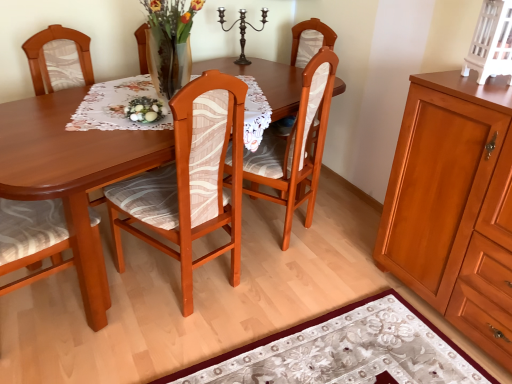
Where is `floral-patterned fabric at lower center`? Image resolution: width=512 pixels, height=384 pixels. floral-patterned fabric at lower center is located at coordinates (345, 351).

The image size is (512, 384). What do you see at coordinates (490, 42) in the screenshot?
I see `white painted wood cabinet at upper right, the second cabinetry ordered from the bottom` at bounding box center [490, 42].

In order to click on white lace tablecloth at center in this screenshot , I will do `click(116, 106)`.

Where is `floral-patterned fabric at lower center`? Image resolution: width=512 pixels, height=384 pixels. floral-patterned fabric at lower center is located at coordinates (345, 351).

From the picture: Considering the relative positions of white painted wood cabinet at upper right, the first cabinetry in the top-to-bottom sequence, and wooden chair at center, the third chair positioned from the left, in the image provided, is white painted wood cabinet at upper right, the first cabinetry in the top-to-bottom sequence, behind wooden chair at center, the third chair positioned from the left,?

That is False.

Could you tell me if white painted wood cabinet at upper right, the second cabinetry ordered from the bottom, is facing wooden chair at center, the third chair positioned from the left?

No, white painted wood cabinet at upper right, the second cabinetry ordered from the bottom, is not aimed at wooden chair at center, the third chair positioned from the left.

From the picture: From the image's perspective, relative to wooden chair at center, the third chair positioned from the left, is white painted wood cabinet at upper right, the second cabinetry ordered from the bottom, above or below?

Clearly, from the image's perspective, white painted wood cabinet at upper right, the second cabinetry ordered from the bottom, is above wooden chair at center, the third chair positioned from the left.

Consider the image. Is white painted wood cabinet at upper right, the second cabinetry ordered from the bottom, not inside wooden chair at center, the third chair positioned from the left?

white painted wood cabinet at upper right, the second cabinetry ordered from the bottom, lies outside wooden chair at center, the third chair positioned from the left,'s area.

Is wooden chair at center, which is the 1th chair in left-to-right order, positioned behind dark brown metal candle holder at upper center?

No.

You are a GUI agent. You are given a task and a screenshot of the screen. Output one action in this format:
    pyautogui.click(x=<x>, y=<y>)
    Task: Click on the candle holder lying on the right of wooden chair at center, positioned as the third chair in right-to-left order
    The image size is (512, 384).
    Given the screenshot: What is the action you would take?
    pyautogui.click(x=242, y=30)

From the image's perspective, does wooden chair at center, positioned as the third chair in right-to-left order, appear lower than dark brown metal candle holder at upper center?

Yes, from the image's perspective, wooden chair at center, positioned as the third chair in right-to-left order, is below dark brown metal candle holder at upper center.

Is wooden chair at center, which is the 1th chair in left-to-right order, bigger than dark brown metal candle holder at upper center?

Correct, wooden chair at center, which is the 1th chair in left-to-right order, is larger in size than dark brown metal candle holder at upper center.

Identify the location of place mat on the right of the white lace tablecloth at center. (345, 351).

Which is nearer, (251, 111) or (376, 298)?

Point (251, 111).

Are white lace tablecloth at center and floral-patterned fabric at lower center beside each other?

They are not placed beside each other.

Is white lace tablecloth at center aimed at floral-patterned fabric at lower center?

No, white lace tablecloth at center is not turned towards floral-patterned fabric at lower center.

Locate an element on the screen. The width and height of the screenshot is (512, 384). place mat in front of the wooden chair at center, positioned as the third chair in right-to-left order is located at coordinates (345, 351).

Is wooden chair at center, positioned as the third chair in right-to-left order, outside of floral-patterned fabric at lower center?

Absolutely, wooden chair at center, positioned as the third chair in right-to-left order, is external to floral-patterned fabric at lower center.

From the image's perspective, is wooden chair at center, positioned as the third chair in right-to-left order, above floral-patterned fabric at lower center?

Yes, from the image's perspective, wooden chair at center, positioned as the third chair in right-to-left order, is above floral-patterned fabric at lower center.

Considering the positions of objects wooden chair at center, positioned as the third chair in right-to-left order, and floral-patterned fabric at lower center in the image provided, who is behind, wooden chair at center, positioned as the third chair in right-to-left order, or floral-patterned fabric at lower center?

wooden chair at center, positioned as the third chair in right-to-left order.

Which object is wider, wooden chair at center, the second chair in the left-to-right sequence, or wooden chair at center, positioned as the third chair in right-to-left order?

wooden chair at center, positioned as the third chair in right-to-left order, is wider.

Is there a large distance between wooden chair at center, positioned as the 2th chair in right-to-left order, and wooden chair at center, positioned as the third chair in right-to-left order?

No, wooden chair at center, positioned as the 2th chair in right-to-left order, is not far from wooden chair at center, positioned as the third chair in right-to-left order.

Which point is more forward, (179,120) or (14,257)?

The point (179,120) is in front.

Which object is closer to the camera taking this photo, wooden chair at center, the second chair in the left-to-right sequence, or wooden chair at center, positioned as the third chair in right-to-left order?

wooden chair at center, the second chair in the left-to-right sequence, is in front.

Is wooden chair at center, the third chair positioned from the left, far away from wooden chair at center, positioned as the third chair in right-to-left order?

Indeed, wooden chair at center, the third chair positioned from the left, is not near wooden chair at center, positioned as the third chair in right-to-left order.

Considering the relative positions of wooden chair at center, the third chair positioned from the left, and wooden chair at center, which is the 1th chair in left-to-right order, in the image provided, is wooden chair at center, the third chair positioned from the left, to the left of wooden chair at center, which is the 1th chair in left-to-right order, from the viewer's perspective?

In fact, wooden chair at center, the third chair positioned from the left, is to the right of wooden chair at center, which is the 1th chair in left-to-right order.

Is wooden chair at center, the third chair positioned from the left, situated inside wooden chair at center, positioned as the third chair in right-to-left order, or outside?

wooden chair at center, the third chair positioned from the left, is not inside wooden chair at center, positioned as the third chair in right-to-left order, it's outside.

Does wooden chair at center, marked as the first chair in a right-to-left arrangement, turn towards wooden chair at center, positioned as the third chair in right-to-left order?

No, wooden chair at center, marked as the first chair in a right-to-left arrangement, does not turn towards wooden chair at center, positioned as the third chair in right-to-left order.

From the image's perspective, who appears lower, wooden chair at center, positioned as the 2th chair in right-to-left order, or white glossy eggs at center?

wooden chair at center, positioned as the 2th chair in right-to-left order, from the image's perspective.

Consider the image. Can you confirm if wooden chair at center, positioned as the 2th chair in right-to-left order, is shorter than white glossy eggs at center?

Incorrect, the height of wooden chair at center, positioned as the 2th chair in right-to-left order, does not fall short of that of white glossy eggs at center.

From the picture: Which of these two, wooden chair at center, positioned as the 2th chair in right-to-left order, or white glossy eggs at center, is bigger?

wooden chair at center, positioned as the 2th chair in right-to-left order, is bigger.

Is wooden chair at center, positioned as the 2th chair in right-to-left order, positioned far away from white glossy eggs at center?

Actually, wooden chair at center, positioned as the 2th chair in right-to-left order, and white glossy eggs at center are a little close together.

This screenshot has height=384, width=512. I want to click on cabinetry above the wooden chair at center, marked as the first chair in a right-to-left arrangement (from a real-world perspective), so click(490, 42).

This screenshot has height=384, width=512. What are the coordinates of `candle holder above the wooden chair at center, which is the 1th chair in left-to-right order (from the image's perspective)` in the screenshot? It's located at (242, 30).

Considering their positions, is white glossy eggs at center positioned closer to matte wood cabinet at right, placed as the second cabinetry when sorted from top to bottom, than wooden chair at center, positioned as the third chair in right-to-left order?

Based on the image, white glossy eggs at center appears to be nearer to matte wood cabinet at right, placed as the second cabinetry when sorted from top to bottom.

Estimate the real-world distances between objects in this image. Which object is closer to white glossy eggs at center, wooden chair at center, the second chair in the left-to-right sequence, or floral-patterned fabric at lower center?

Based on the image, wooden chair at center, the second chair in the left-to-right sequence, appears to be nearer to white glossy eggs at center.

Looking at the image, which one is located further to wooden chair at center, positioned as the third chair in right-to-left order, white glossy eggs at center or wooden chair at center, the third chair positioned from the left?

wooden chair at center, the third chair positioned from the left, is positioned further to the anchor wooden chair at center, positioned as the third chair in right-to-left order.

From the picture: From the image, which object appears to be farther from wooden chair at center, positioned as the third chair in right-to-left order, white lace tablecloth at center or dark brown metal candle holder at upper center?

dark brown metal candle holder at upper center.

Which object lies nearer to the anchor point wooden chair at center, positioned as the 2th chair in right-to-left order, dark brown metal candle holder at upper center or wooden chair at center, positioned as the third chair in right-to-left order?

wooden chair at center, positioned as the third chair in right-to-left order, is positioned closer to the anchor wooden chair at center, positioned as the 2th chair in right-to-left order.

Considering their positions, is matte wood cabinet at right, the first cabinetry in the bottom-to-top sequence, positioned further to wooden chair at center, marked as the first chair in a right-to-left arrangement, than dark brown metal candle holder at upper center?

dark brown metal candle holder at upper center is positioned further to the anchor wooden chair at center, marked as the first chair in a right-to-left arrangement.

Considering their positions, is white glossy eggs at center positioned closer to white lace tablecloth at center than wooden chair at center, the third chair positioned from the left?

white glossy eggs at center is positioned closer to the anchor white lace tablecloth at center.

Based on their spatial positions, is wooden chair at center, the second chair in the left-to-right sequence, or wooden chair at center, the third chair positioned from the left, closer to floral-patterned fabric at lower center?

The object closer to floral-patterned fabric at lower center is wooden chair at center, the second chair in the left-to-right sequence.

The width and height of the screenshot is (512, 384). What are the coordinates of `tablecloth located between wooden chair at center, the second chair in the left-to-right sequence, and white glossy eggs at center in the depth direction` in the screenshot? It's located at (116, 106).

Find the location of a particular element. The width and height of the screenshot is (512, 384). food located between white lace tablecloth at center and dark brown metal candle holder at upper center in the depth direction is located at coordinates (145, 110).

This screenshot has height=384, width=512. Find the location of `place mat between wooden chair at center, positioned as the third chair in right-to-left order, and white painted wood cabinet at upper right, the second cabinetry ordered from the bottom`. place mat between wooden chair at center, positioned as the third chair in right-to-left order, and white painted wood cabinet at upper right, the second cabinetry ordered from the bottom is located at coordinates (345, 351).

Find the location of a particular element. This screenshot has width=512, height=384. candle holder between white glossy eggs at center and matte wood cabinet at right, placed as the second cabinetry when sorted from top to bottom, in the horizontal direction is located at coordinates (242, 30).